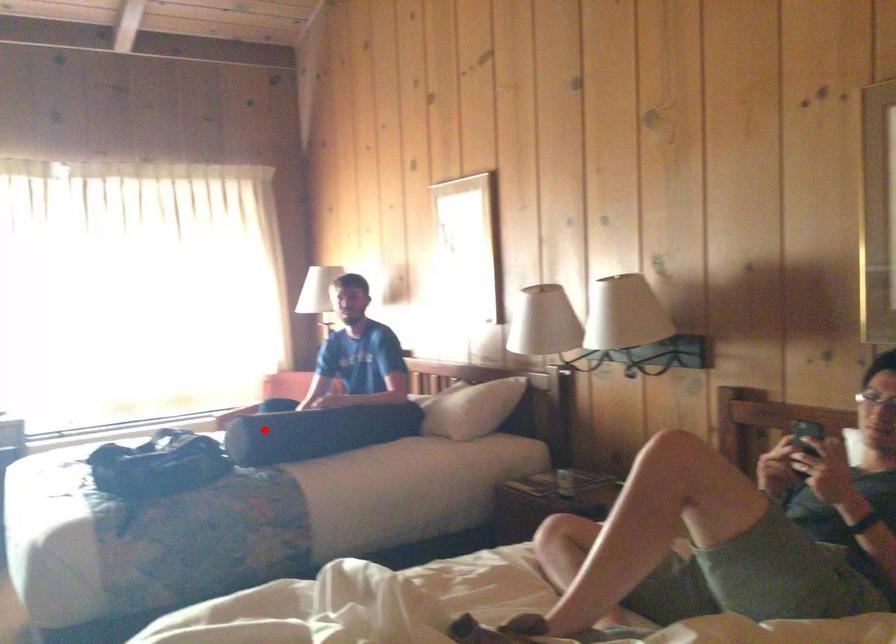
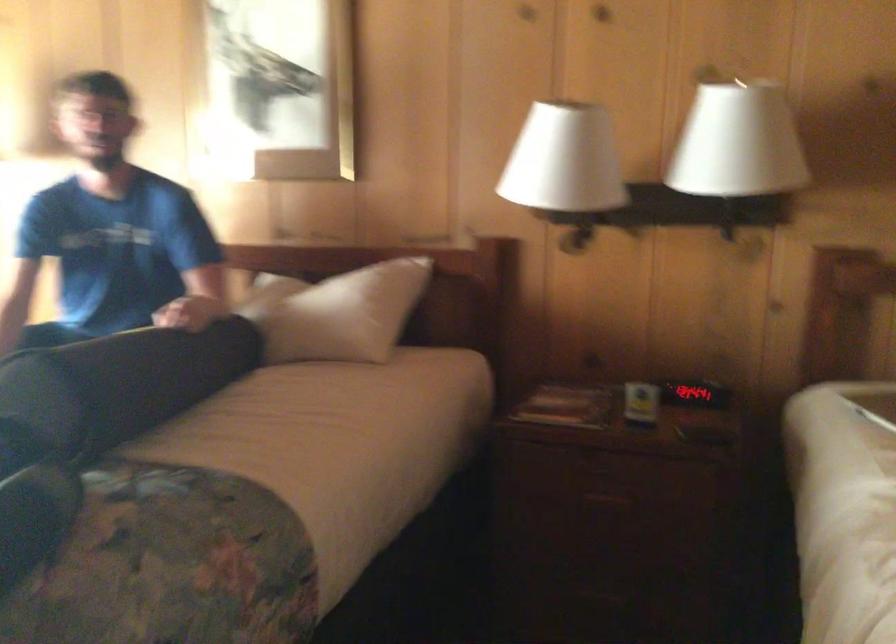
The point at the highlighted location is marked in the first image. Where is the corresponding point in the second image?

(122, 383)